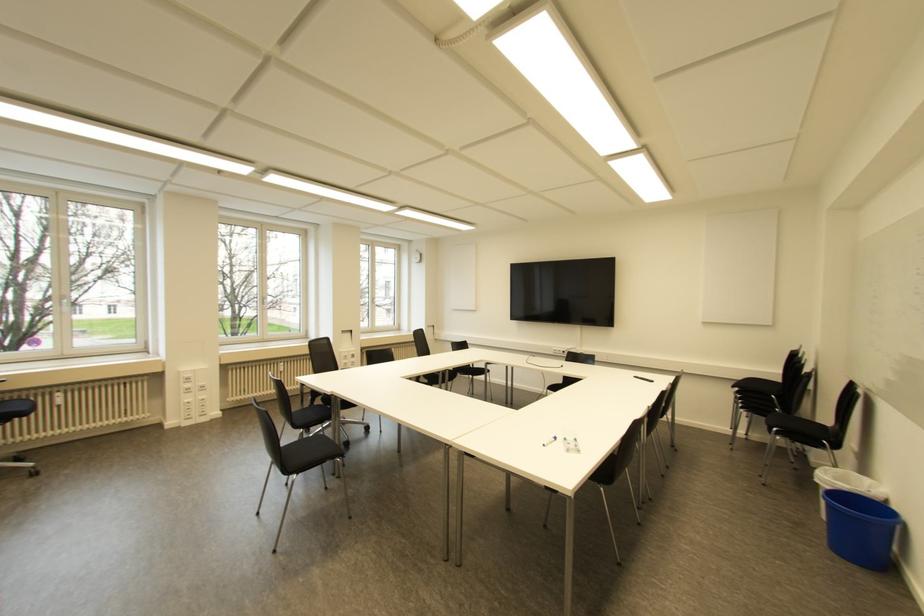
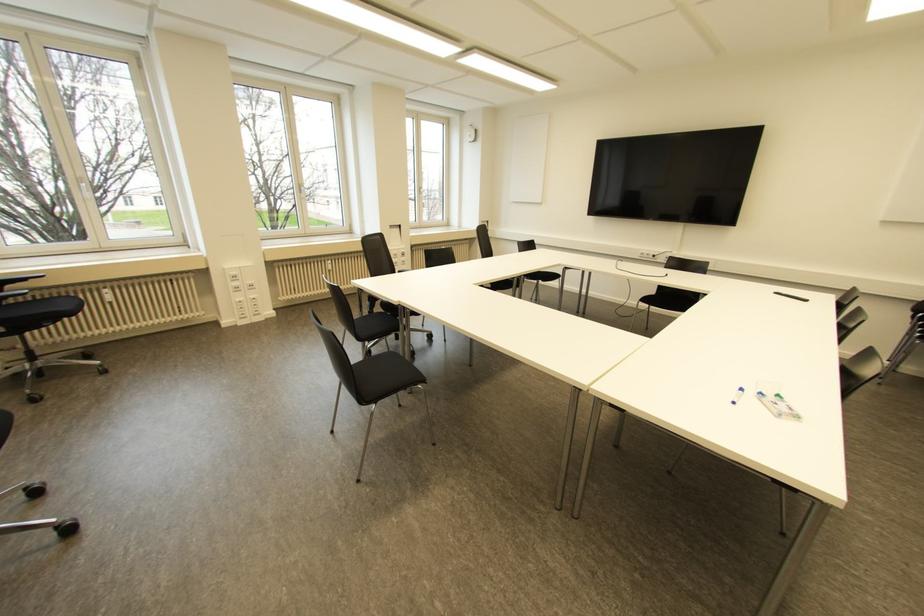
Locate, in the second image, the point that corresponds to (342,455) in the first image.

(422, 381)